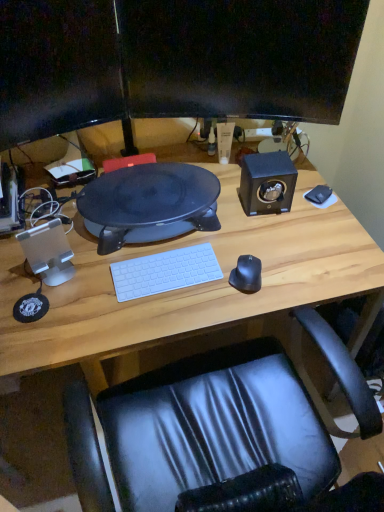
The width and height of the screenshot is (384, 512). Identify the location of free space that is in between black matte speaker at upper right, marked as the second speaker in a front-to-back arrangement, and white matte keyboard at center. (216, 234).